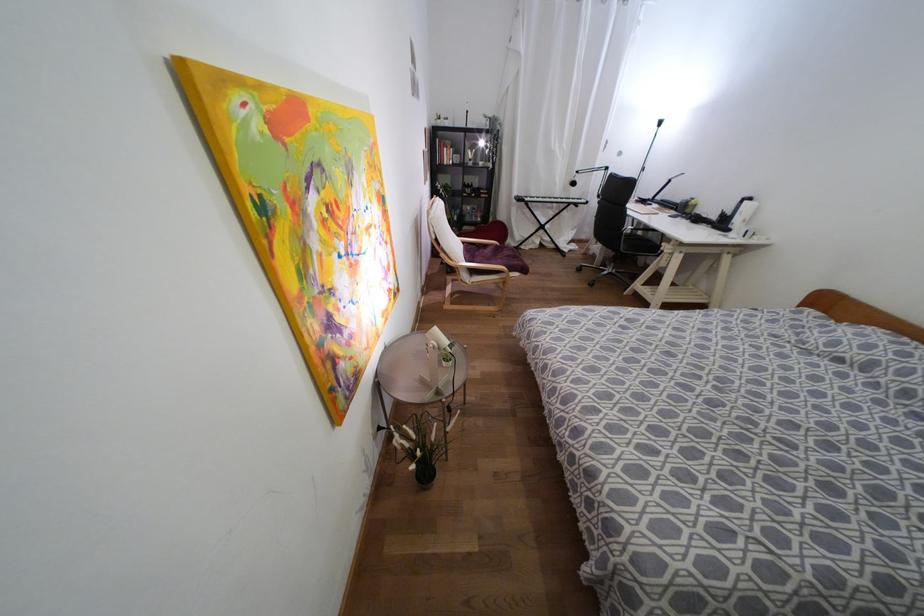
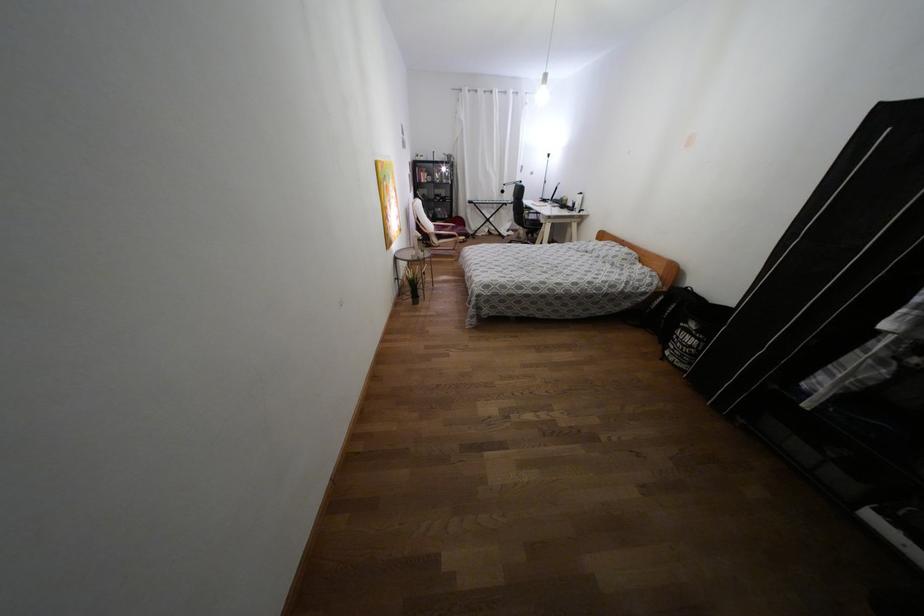
Find the pixel in the second image that matches the point at 472,270 in the first image.

(439, 237)